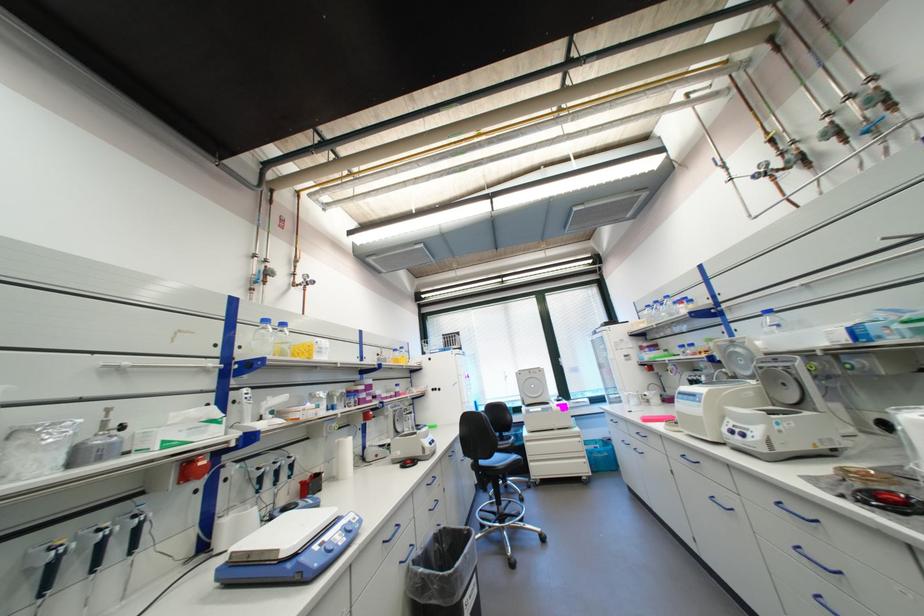
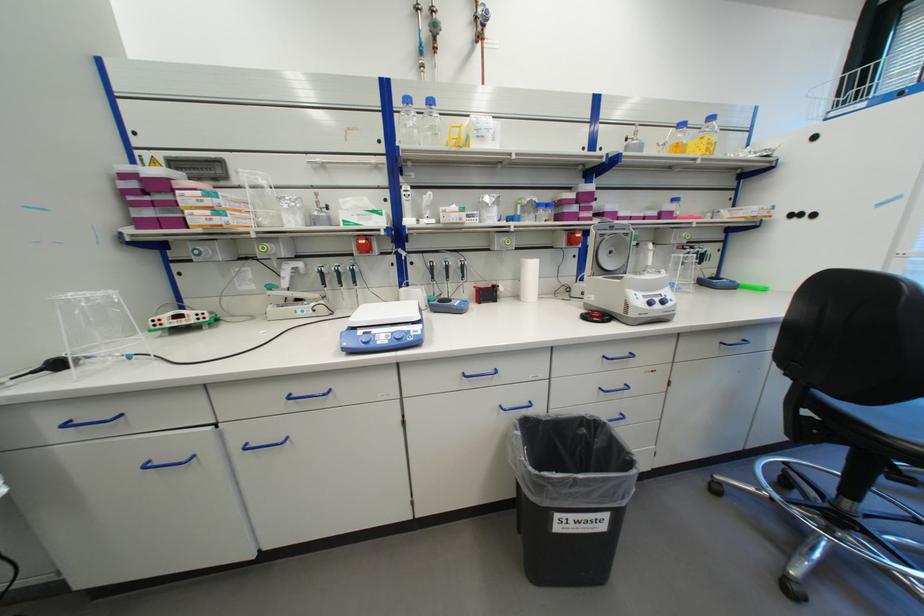
Where in the second image is the point corresponding to (x=370, y=387) from the first image?

(579, 197)